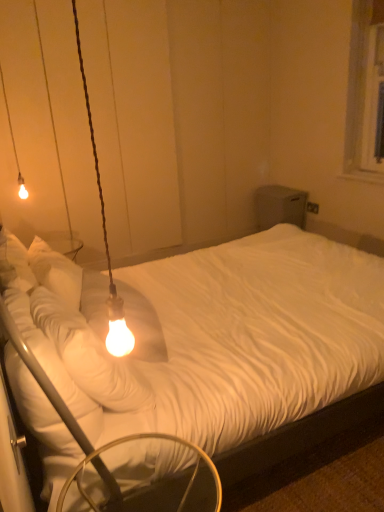
Question: From a real-world perspective, is metallic silver swivel chair at lower left located higher than matte glass bulb at upper left, marked as the second lamp in a right-to-left arrangement?

Choices:
 (A) yes
 (B) no

Answer: (B)

Question: Could you tell me if metallic silver swivel chair at lower left is turned towards matte glass bulb at upper left, marked as the second lamp in a right-to-left arrangement?

Choices:
 (A) yes
 (B) no

Answer: (B)

Question: Would you consider metallic silver swivel chair at lower left to be distant from matte glass bulb at upper left, the second lamp in the bottom-to-top sequence?

Choices:
 (A) no
 (B) yes

Answer: (B)

Question: Is metallic silver swivel chair at lower left next to matte glass bulb at upper left, marked as the second lamp in a right-to-left arrangement, and touching it?

Choices:
 (A) no
 (B) yes

Answer: (A)

Question: Can you confirm if metallic silver swivel chair at lower left is thinner than matte glass bulb at upper left, which appears as the first lamp when viewed from the left?

Choices:
 (A) no
 (B) yes

Answer: (A)

Question: Is point (72, 8) closer or farther from the camera than point (6, 102)?

Choices:
 (A) farther
 (B) closer

Answer: (A)

Question: Looking at their shapes, would you say matte glass bulb at left, which is the 1th lamp in right-to-left order, is wider or thinner than matte glass bulb at upper left, which appears as the first lamp when viewed from the left?

Choices:
 (A) wide
 (B) thin

Answer: (B)

Question: Considering the positions of matte glass bulb at left, marked as the second lamp in a left-to-right arrangement, and matte glass bulb at upper left, which appears as the 2th lamp when viewed from the front, in the image, is matte glass bulb at left, marked as the second lamp in a left-to-right arrangement, taller or shorter than matte glass bulb at upper left, which appears as the 2th lamp when viewed from the front,?

Choices:
 (A) tall
 (B) short

Answer: (B)

Question: In terms of size, does matte glass bulb at left, which ranks as the second lamp in top-to-bottom order, appear bigger or smaller than matte glass bulb at upper left, the first lamp in the top-to-bottom sequence?

Choices:
 (A) small
 (B) big

Answer: (A)

Question: From a real-world perspective, is metallic silver swivel chair at lower left physically located above or below matte glass bulb at upper left, the second lamp in the bottom-to-top sequence?

Choices:
 (A) below
 (B) above

Answer: (A)

Question: In terms of width, does metallic silver swivel chair at lower left look wider or thinner when compared to matte glass bulb at upper left, marked as the second lamp in a right-to-left arrangement?

Choices:
 (A) thin
 (B) wide

Answer: (B)

Question: From the image's perspective, relative to matte glass bulb at upper left, the first lamp in the top-to-bottom sequence, is metallic silver swivel chair at lower left above or below?

Choices:
 (A) above
 (B) below

Answer: (B)

Question: In terms of size, does metallic silver swivel chair at lower left appear bigger or smaller than matte glass bulb at upper left, the second lamp in the bottom-to-top sequence?

Choices:
 (A) big
 (B) small

Answer: (A)

Question: Does point (119, 348) appear closer or farther from the camera than point (157, 435)?

Choices:
 (A) closer
 (B) farther

Answer: (B)

Question: Would you say matte glass bulb at left, marked as the second lamp in a left-to-right arrangement, is to the left or to the right of metallic silver swivel chair at lower left in the picture?

Choices:
 (A) right
 (B) left

Answer: (B)